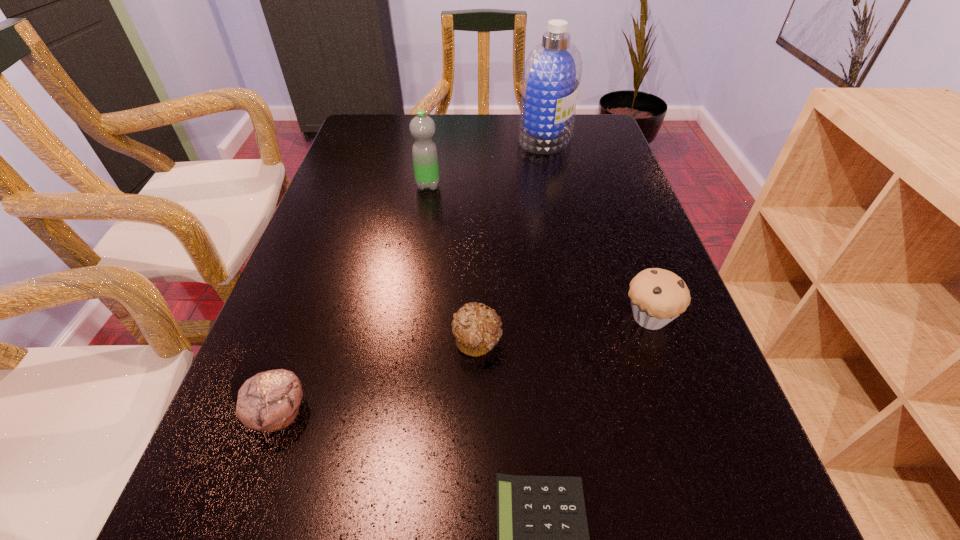
Identify the location of cleansing agent. The height and width of the screenshot is (540, 960). (552, 72).

Locate an element on the screen. Image resolution: width=960 pixels, height=540 pixels. the tallest object is located at coordinates (552, 72).

Locate an element on the screen. the second object from left to right is located at coordinates (424, 151).

Where is `water bottle`? water bottle is located at coordinates [x=424, y=151].

Where is `the tallest muffin`? the tallest muffin is located at coordinates (658, 296).

Find the location of a particular element. the third tallest object is located at coordinates (658, 296).

Find the location of a particular element. The image size is (960, 540). the second nearest object is located at coordinates (269, 401).

The width and height of the screenshot is (960, 540). Find the location of `the nearest muffin`. the nearest muffin is located at coordinates (269, 401).

Find the location of a particular element. The height and width of the screenshot is (540, 960). the shortest muffin is located at coordinates (477, 330).

This screenshot has width=960, height=540. Find the location of `the second muffin from left to right`. the second muffin from left to right is located at coordinates (477, 330).